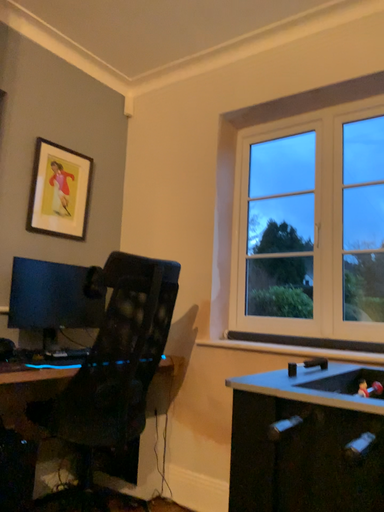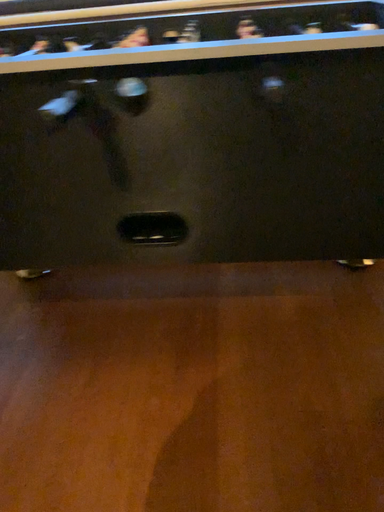
Question: Which way did the camera rotate in the video?

Choices:
 (A) rotated right
 (B) rotated left

Answer: (A)